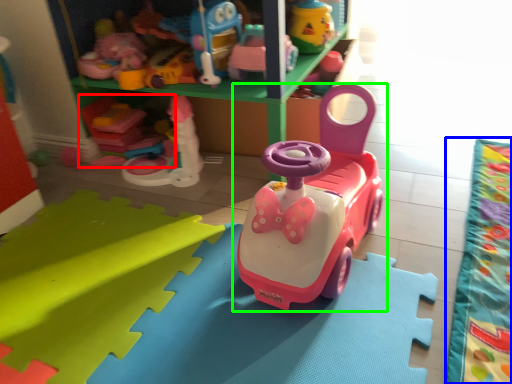
Question: Based on their relative distances, which object is nearer to toy (highlighted by a red box)? Choose from blanket (highlighted by a blue box) and toy (highlighted by a green box).

Choices:
 (A) blanket
 (B) toy

Answer: (B)